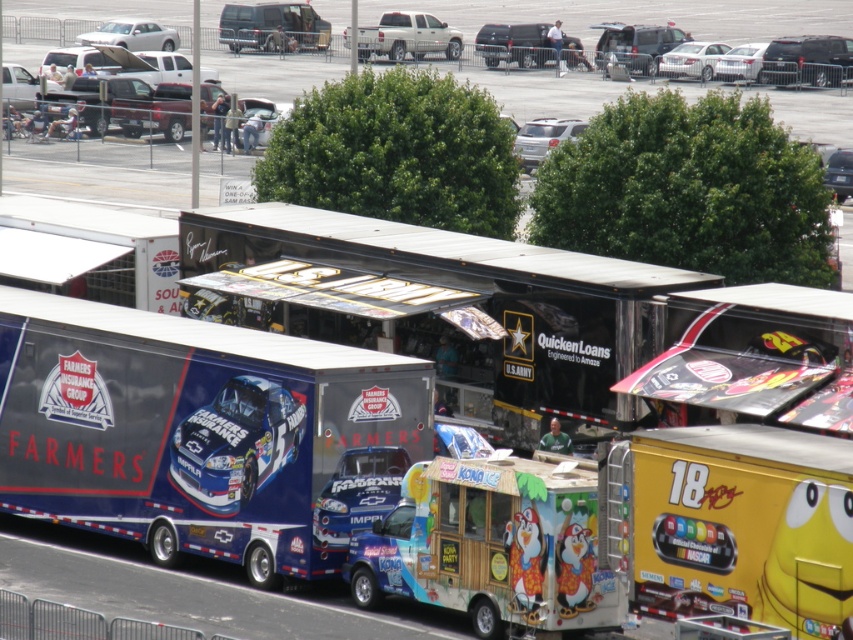
Question: Estimate the real-world distances between objects in this image. Which object is closer to the silver metallic truck at center?

Choices:
 (A) matte blue food truck at center
 (B) black matte van at center
 (C) satin silver suv at upper center

Answer: (B)

Question: Does satin silver suv at upper center lie in front of metallic silver car at center?

Choices:
 (A) yes
 (B) no

Answer: (B)

Question: Considering the real-world distances, which object is closest to the matte blue race car at center?

Choices:
 (A) silver metallic truck at upper left
 (B) silver metallic sedan at upper left

Answer: (A)

Question: Is matte blue food truck at center below silver metallic truck at center?

Choices:
 (A) yes
 (B) no

Answer: (A)

Question: Which point is closer to the camera taking this photo?

Choices:
 (A) (129, 339)
 (B) (714, 74)
 (C) (488, 60)
 (D) (398, 54)

Answer: (A)

Question: Does silver metallic sedan at upper left appear on the left side of metallic silver car at center?

Choices:
 (A) no
 (B) yes

Answer: (B)